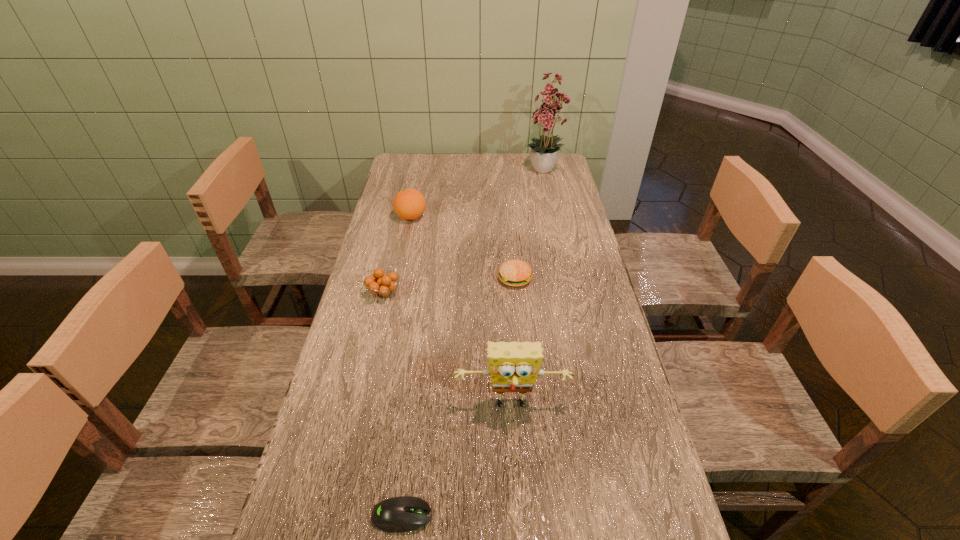
This screenshot has height=540, width=960. I want to click on vacant space at the far edge of the desktop, so click(x=514, y=154).

In order to click on free space at the left edge of the desktop in this screenshot , I will do [340, 429].

Image resolution: width=960 pixels, height=540 pixels. In order to click on free space at the right edge of the desktop in this screenshot , I will do `click(636, 404)`.

The height and width of the screenshot is (540, 960). I want to click on vacant space at the far left corner, so click(x=424, y=180).

Where is `free space that is in between the patty and the flower arrangement`? The height and width of the screenshot is (540, 960). free space that is in between the patty and the flower arrangement is located at coordinates (530, 225).

Locate an element on the screen. free space between the second shortest object and the shortest object is located at coordinates (459, 397).

You are a GUI agent. You are given a task and a screenshot of the screen. Output one action in this format:
    pyautogui.click(x=<x>, y=<y>)
    Task: Click on the free spot between the farthest object and the fifth nearest object
    The width and height of the screenshot is (960, 540).
    Given the screenshot: What is the action you would take?
    pyautogui.click(x=478, y=194)

Find the location of `vacant area that lies between the patty and the taller orange fruit`. vacant area that lies between the patty and the taller orange fruit is located at coordinates (463, 248).

Find the location of a particular element. vacant area between the flower arrangement and the nearer orange fruit is located at coordinates (465, 232).

Find the location of a particular element. The image size is (960, 540). free area in between the fourth shortest object and the fifth shortest object is located at coordinates (461, 312).